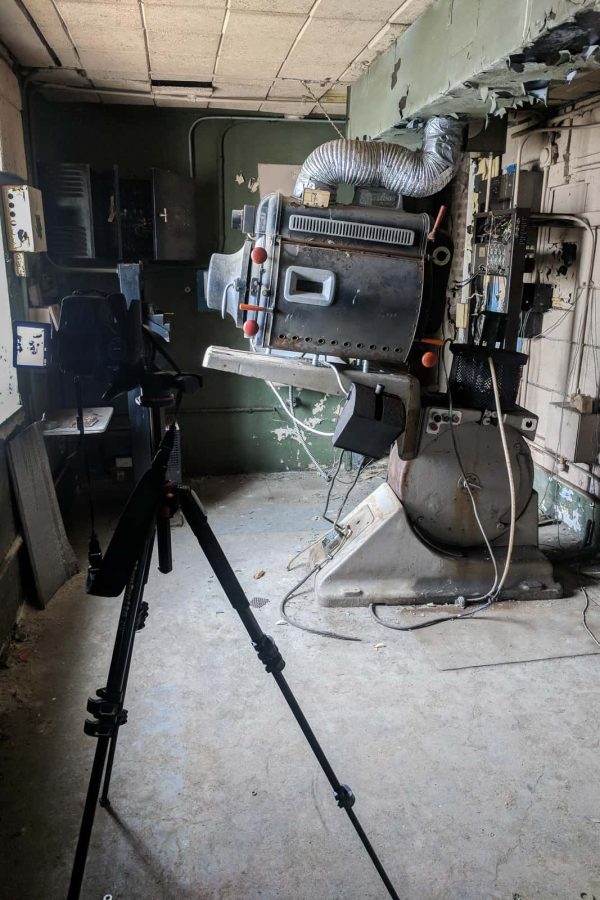
Locate an element on the screen. green wall is located at coordinates (226, 394).